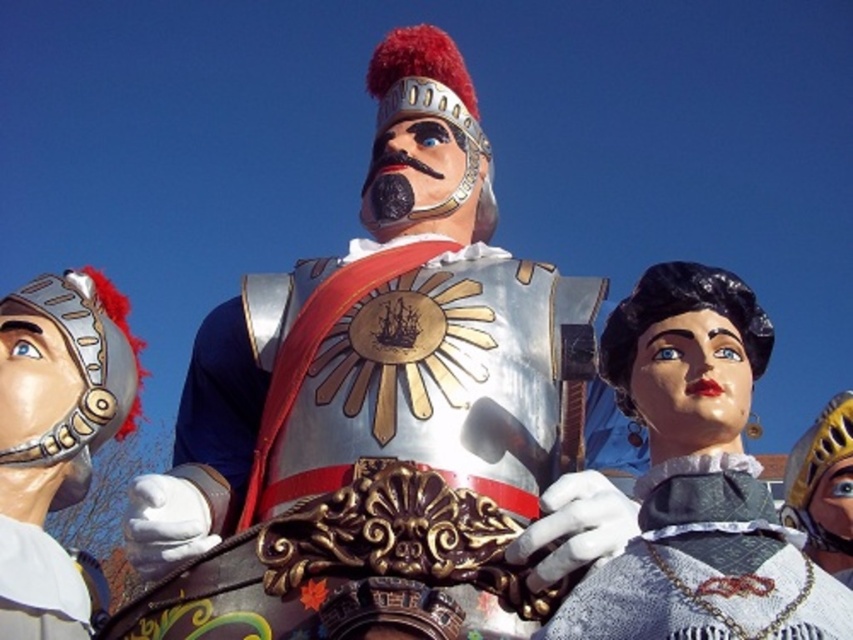
Does silver metallic chain at center have a greater width compared to metallic helmet at left?

No.

Between silver metallic chain at center and metallic helmet at left, which one is positioned lower?

silver metallic chain at center is below.

At what (x,y) coordinates should I click in order to perform the action: click on silver metallic chain at center. Please return your answer as a coordinate pair (x, y). The width and height of the screenshot is (853, 640). Looking at the image, I should click on (705, 566).

I want to click on silver metallic chain at center, so click(x=705, y=566).

Does smooth black wig at center have a lesser height compared to silver metallic chain at center?

No, smooth black wig at center is not shorter than silver metallic chain at center.

Can you confirm if smooth black wig at center is thinner than silver metallic chain at center?

Yes.

Where is `smooth black wig at center`? smooth black wig at center is located at coordinates (697, 481).

This screenshot has width=853, height=640. What are the coordinates of `smooth black wig at center` in the screenshot? It's located at (697, 481).

Can you confirm if silver metallic chain at center is positioned above gold metallic helmet at right?

Actually, silver metallic chain at center is below gold metallic helmet at right.

Can you confirm if silver metallic chain at center is shorter than gold metallic helmet at right?

A: Yes, silver metallic chain at center is shorter than gold metallic helmet at right.

Is point (775, 548) positioned in front of point (816, 440)?

Yes, it is in front of point (816, 440).

At what (x,y) coordinates should I click in order to perform the action: click on silver metallic chain at center. Please return your answer as a coordinate pair (x, y). This screenshot has height=640, width=853. Looking at the image, I should click on [705, 566].